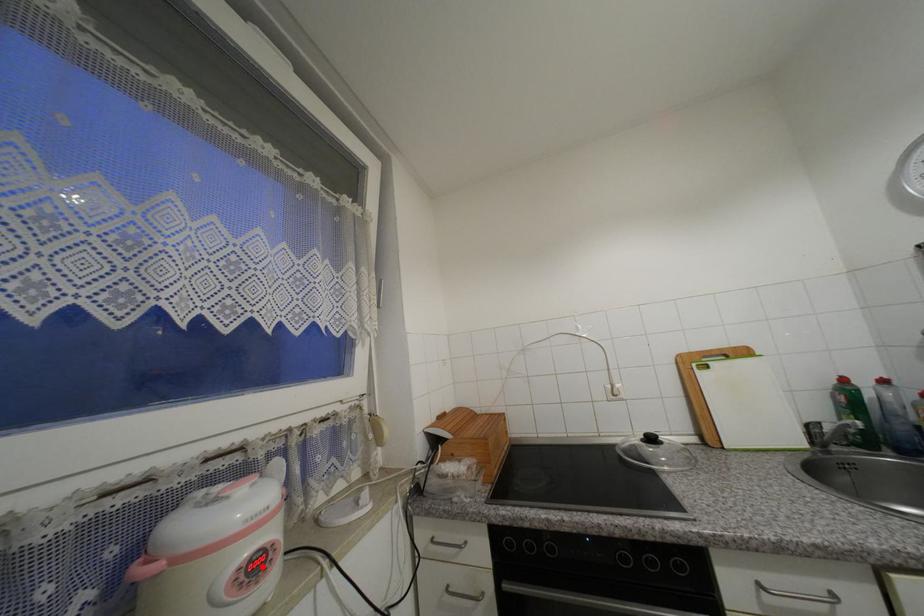
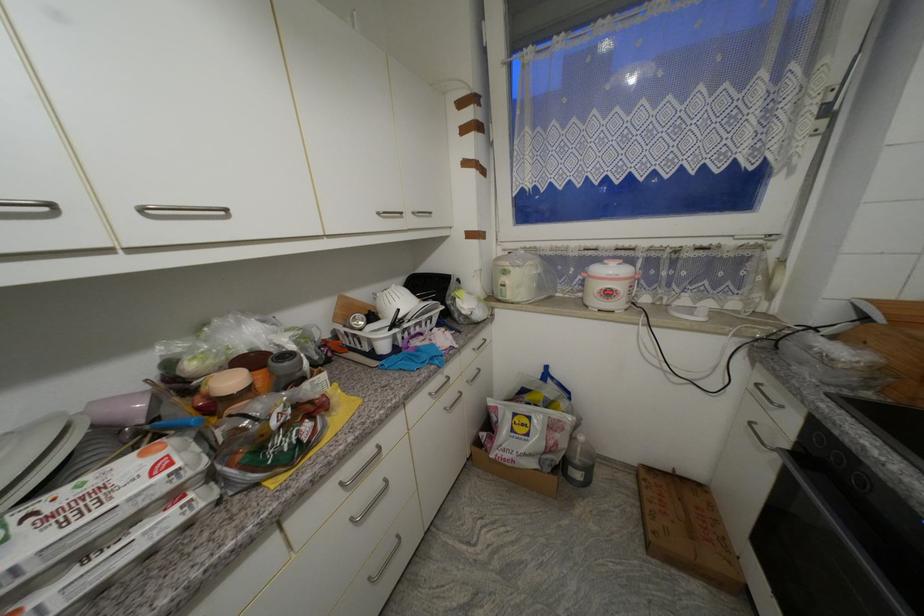
In the second image, find the point that corresponds to the highlighted location in the first image.

(614, 294)